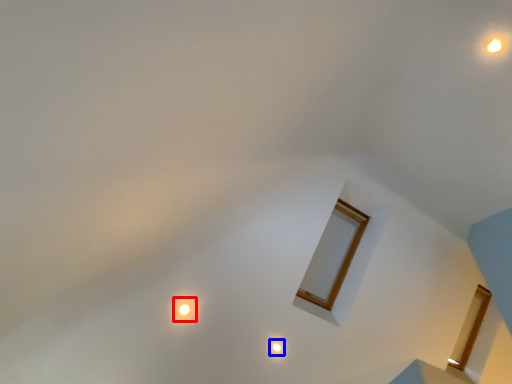
Question: Among these objects, which one is farthest to the camera, glow (highlighted by a red box) or light (highlighted by a blue box)?

Choices:
 (A) glow
 (B) light

Answer: (B)